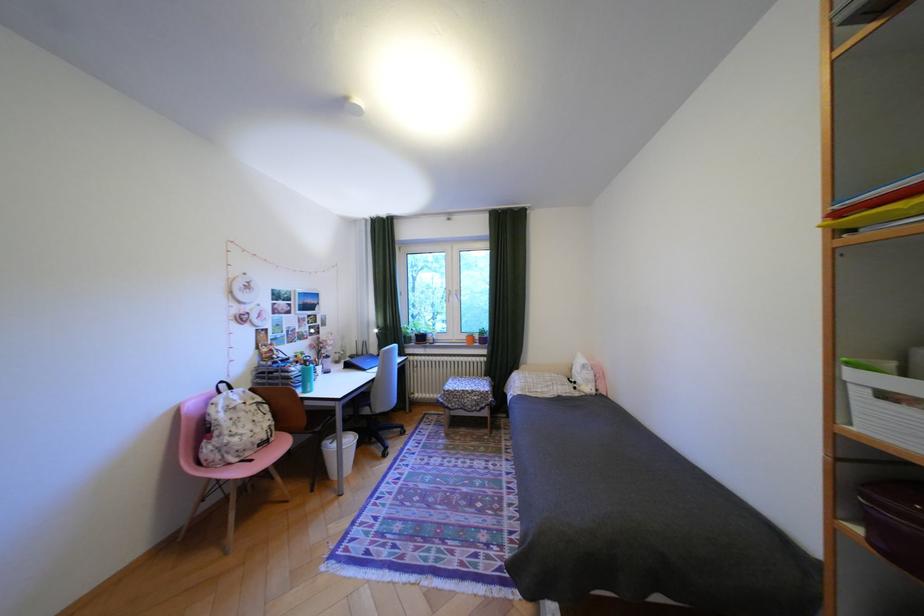
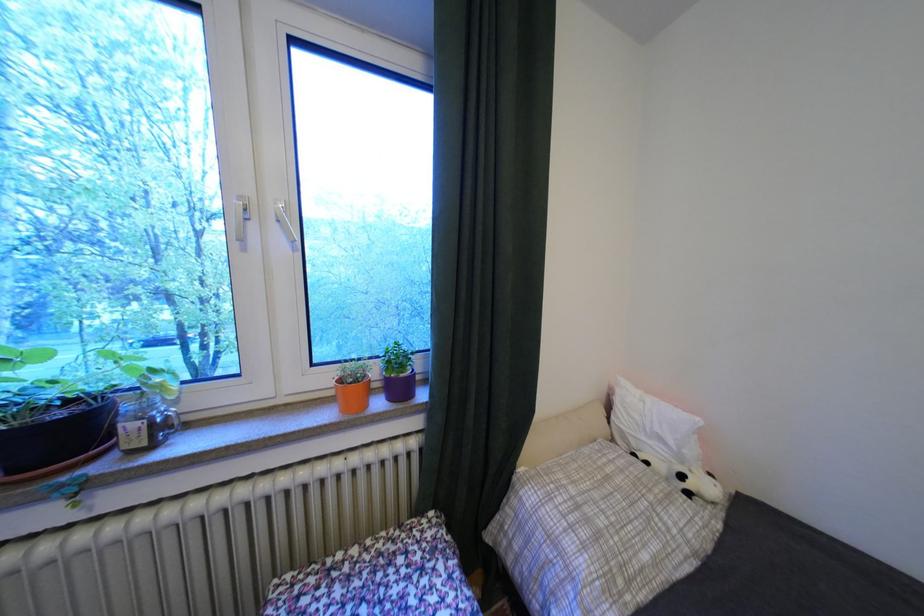
Where in the second image is the point corresponding to the point at 433,339 from the first image?

(75, 436)